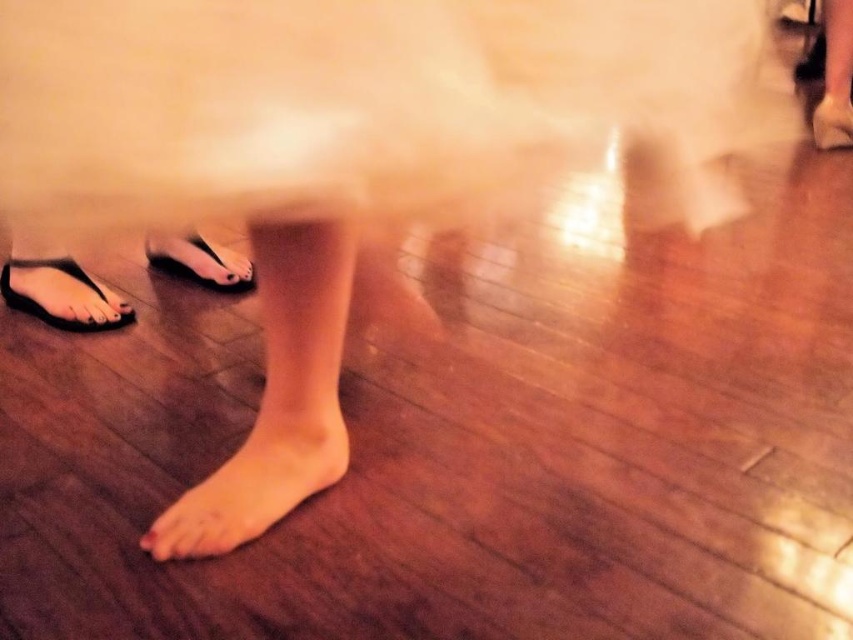
Is the position of smooth skin foot at center more distant than that of black rubber flip-flop at lower left?

No, it is in front of black rubber flip-flop at lower left.

Which is in front, point (212, 522) or point (42, 321)?

Positioned in front is point (212, 522).

Locate an element on the screen. This screenshot has height=640, width=853. smooth skin foot at center is located at coordinates (253, 484).

Who is taller, matte black dress at center or black rubber flip-flop at lower left?

matte black dress at center

Is matte black dress at center in front of black rubber flip-flop at lower left?

Yes.

This screenshot has height=640, width=853. I want to click on matte black dress at center, so click(x=364, y=100).

Find the location of a particular element. This screenshot has height=640, width=853. matte black dress at center is located at coordinates (364, 100).

At what (x,y) coordinates should I click in order to perform the action: click on black rubber flip-flop at lower left. Please return your answer as a coordinate pair (x, y). The height and width of the screenshot is (640, 853). Looking at the image, I should click on (44, 308).

Which is in front, point (70, 272) or point (828, 97)?

Point (70, 272)

Between point (67, 269) and point (820, 122), which one is positioned in front?

Positioned in front is point (67, 269).

The height and width of the screenshot is (640, 853). Find the location of `black rubber flip-flop at lower left`. black rubber flip-flop at lower left is located at coordinates (44, 308).